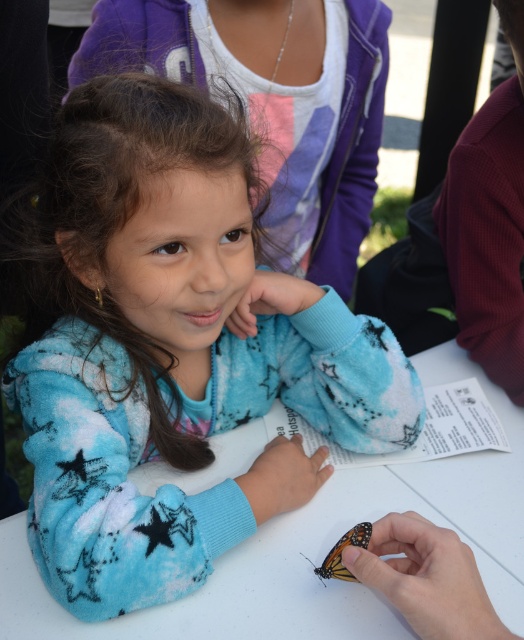
You are a photographer trying to capture the girl and the butterfly. The blue fuzzy sweater at center and the white fabric table at center are in the frame. Which object takes up more space in the photo?

The blue fuzzy sweater at center takes up more space in the photo because it has a larger size compared to the white fabric table at center.

Looking at this image, based on the scene description, where is the white fabric table at center in relation to the orange and black winged butterfly at lower center?

The white fabric table at center is to the right of the orange and black winged butterfly at lower center.

The girl is wearing a blue fuzzy sweater at center and sitting at a white fabric table at center. From the perspective of someone looking at the scene, which object is closer to the viewer?

The blue fuzzy sweater at center is closer to the viewer because it is in front of the white fabric table at center.